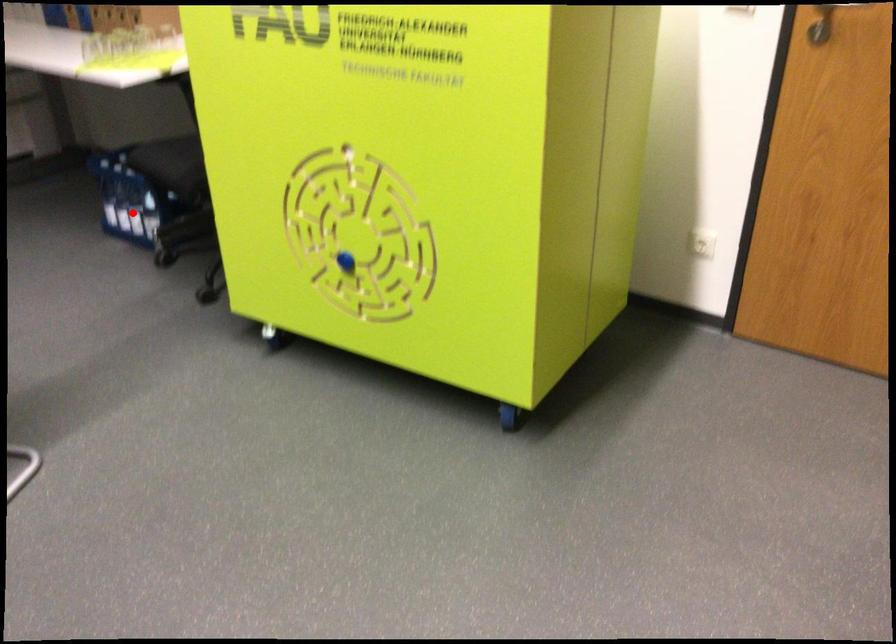
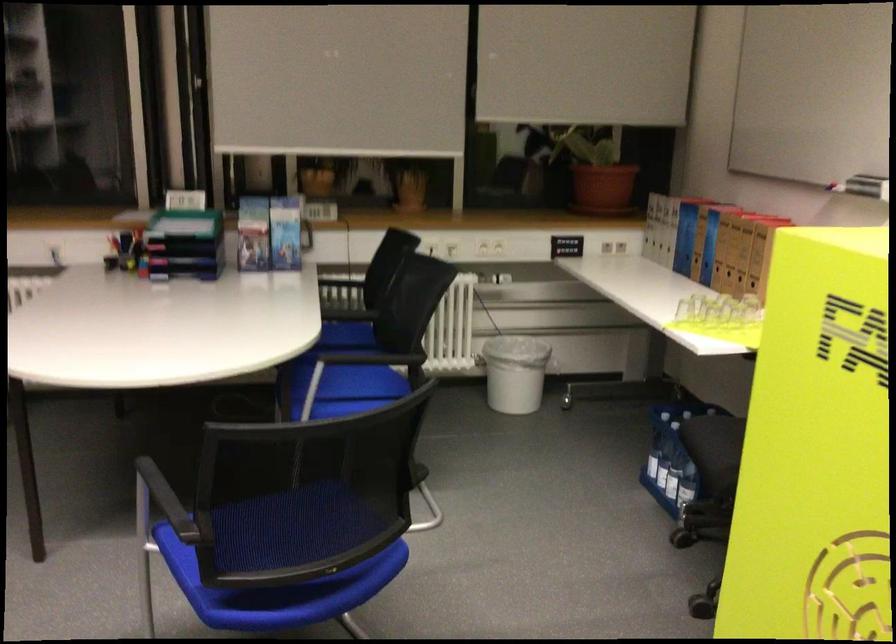
Question: I am providing you with two images of the same scene from different viewpoints. A red point is marked on the first image. Can you still see the location of the red point in image 2?

Choices:
 (A) Yes
 (B) No

Answer: (A)